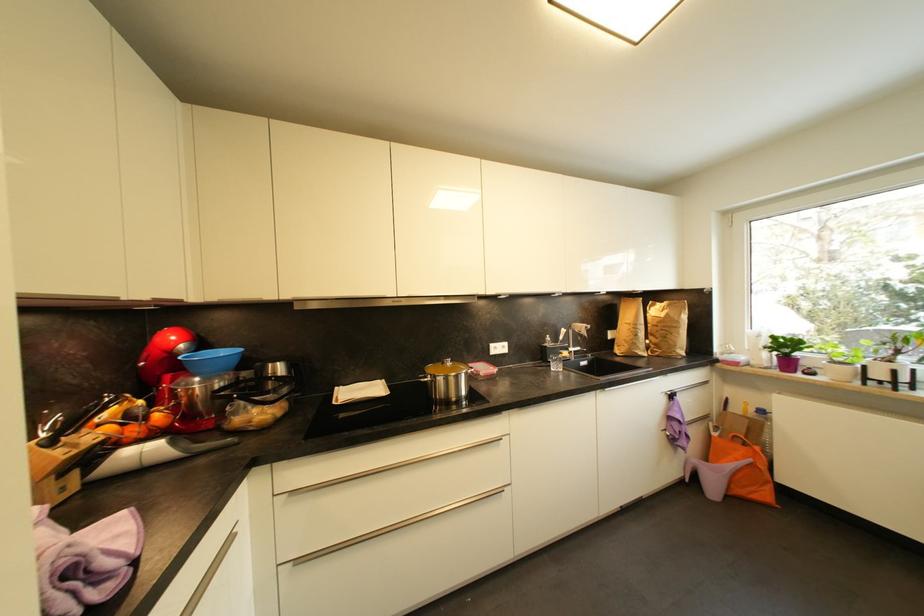
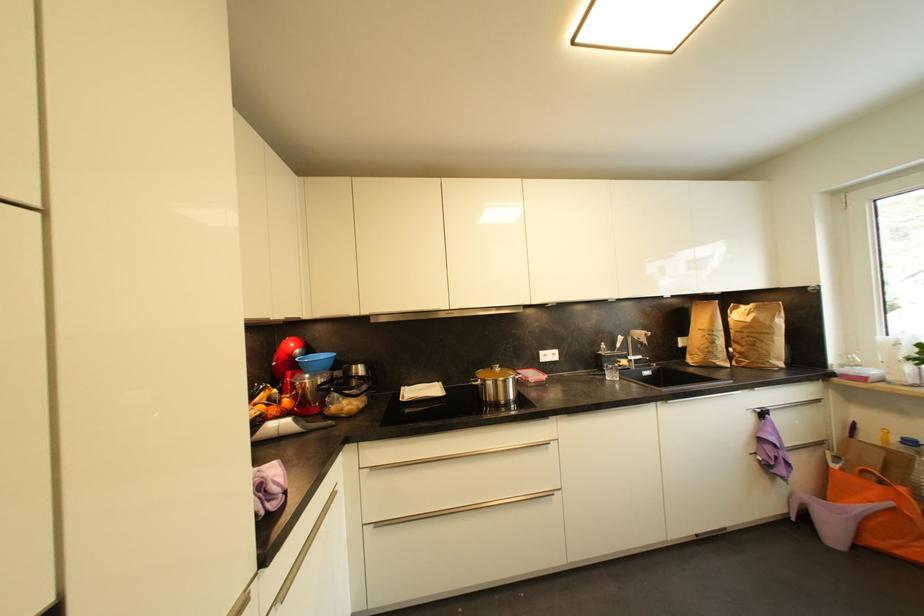
Locate, in the second image, the point that corresponds to [139,432] in the first image.

(277, 411)